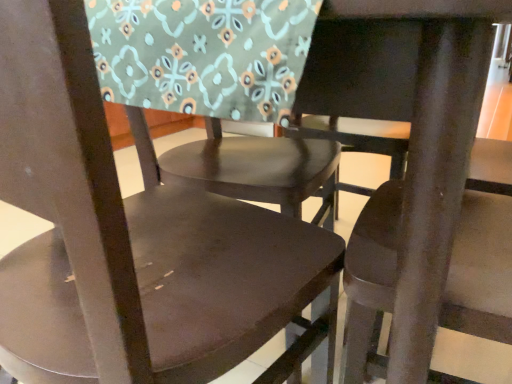
Question: In which direction should I rotate to look at matte brown chair at center, arranged as the 2th chair when viewed from the left?

Choices:
 (A) left
 (B) right

Answer: (B)

Question: Considering the relative sizes of matte brown chair at center, placed as the second chair when sorted from right to left, and matte brown chair at center, the 3th chair viewed from the right, in the image provided, is matte brown chair at center, placed as the second chair when sorted from right to left, wider than matte brown chair at center, the 3th chair viewed from the right,?

Choices:
 (A) yes
 (B) no

Answer: (B)

Question: Is matte brown chair at center, arranged as the 2th chair when viewed from the left, not within matte brown chair at center, the 3th chair viewed from the right?

Choices:
 (A) yes
 (B) no

Answer: (A)

Question: Is matte brown chair at center, placed as the second chair when sorted from right to left, facing towards matte brown chair at center, the 3th chair viewed from the right?

Choices:
 (A) no
 (B) yes

Answer: (A)

Question: From a real-world perspective, is matte brown chair at center, arranged as the 2th chair when viewed from the left, positioned under matte brown chair at center, which is counted as the first chair, starting from the left, based on gravity?

Choices:
 (A) yes
 (B) no

Answer: (B)

Question: Considering the relative positions of matte brown chair at center, placed as the second chair when sorted from right to left, and matte brown chair at center, which is counted as the first chair, starting from the left, in the image provided, is matte brown chair at center, placed as the second chair when sorted from right to left, behind matte brown chair at center, which is counted as the first chair, starting from the left,?

Choices:
 (A) no
 (B) yes

Answer: (B)

Question: Are matte brown chair at center, placed as the second chair when sorted from right to left, and matte brown chair at center, the 3th chair viewed from the right, beside each other?

Choices:
 (A) no
 (B) yes

Answer: (A)

Question: Considering the relative sizes of matte brown chair at center, which is counted as the first chair, starting from the left, and matte brown chair at center, which ranks as the third chair in left-to-right order, in the image provided, is matte brown chair at center, which is counted as the first chair, starting from the left, bigger than matte brown chair at center, which ranks as the third chair in left-to-right order,?

Choices:
 (A) yes
 (B) no

Answer: (A)

Question: Considering the relative positions of matte brown chair at center, the 3th chair viewed from the right, and matte brown chair at center, which appears as the 1th chair when viewed from the right, in the image provided, is matte brown chair at center, the 3th chair viewed from the right, to the right of matte brown chair at center, which appears as the 1th chair when viewed from the right, from the viewer's perspective?

Choices:
 (A) yes
 (B) no

Answer: (B)

Question: From the image's perspective, is matte brown chair at center, which is counted as the first chair, starting from the left, below matte brown chair at center, which ranks as the third chair in left-to-right order?

Choices:
 (A) no
 (B) yes

Answer: (A)

Question: Can you confirm if matte brown chair at center, which is counted as the first chair, starting from the left, is positioned to the left of matte brown chair at center, which ranks as the third chair in left-to-right order?

Choices:
 (A) yes
 (B) no

Answer: (A)

Question: Is matte brown chair at center, which is counted as the first chair, starting from the left, located outside matte brown chair at center, which ranks as the third chair in left-to-right order?

Choices:
 (A) yes
 (B) no

Answer: (A)

Question: Considering the relative sizes of matte brown chair at center, the 3th chair viewed from the right, and matte brown chair at center, which appears as the 1th chair when viewed from the right, in the image provided, is matte brown chair at center, the 3th chair viewed from the right, thinner than matte brown chair at center, which appears as the 1th chair when viewed from the right,?

Choices:
 (A) yes
 (B) no

Answer: (B)

Question: Can you confirm if matte brown chair at center, placed as the second chair when sorted from right to left, is positioned to the left of matte brown chair at center, which appears as the 1th chair when viewed from the right?

Choices:
 (A) no
 (B) yes

Answer: (B)